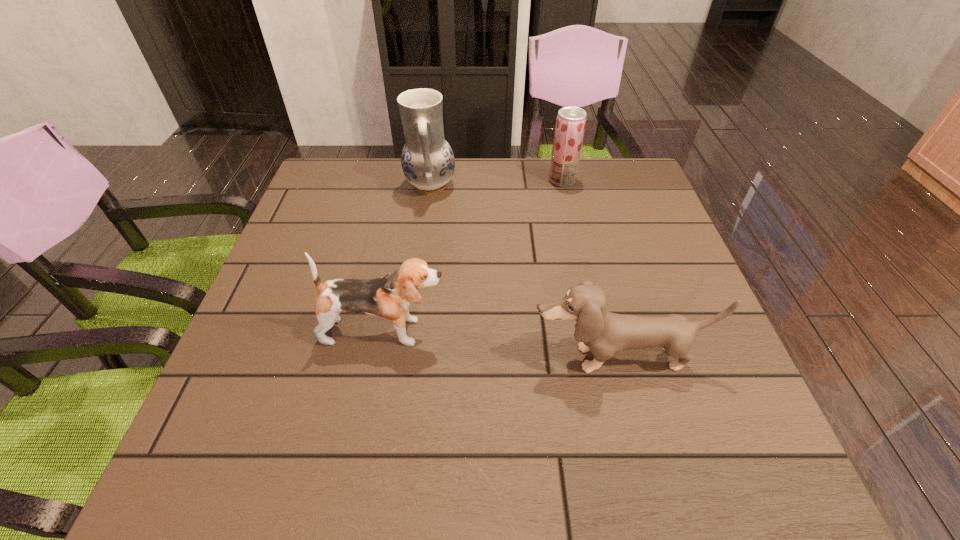
Identify the location of free space between the fruit juice and the tallest object. (496, 183).

The width and height of the screenshot is (960, 540). I want to click on free space between the right puppy and the fruit juice, so click(x=590, y=269).

Identify the location of empty space between the fruit juice and the left puppy. Image resolution: width=960 pixels, height=540 pixels. (473, 256).

Locate an element on the screen. This screenshot has height=540, width=960. blank region between the left puppy and the tallest object is located at coordinates (407, 259).

Where is `free area in between the left puppy and the right puppy`? The height and width of the screenshot is (540, 960). free area in between the left puppy and the right puppy is located at coordinates (501, 345).

I want to click on free space between the right puppy and the left puppy, so click(501, 345).

Where is `unoccupied position between the pottery and the left puppy`? unoccupied position between the pottery and the left puppy is located at coordinates (407, 259).

The width and height of the screenshot is (960, 540). I want to click on unoccupied area between the fruit juice and the pottery, so click(496, 183).

Select which object appears as the third closest to the left puppy. Please provide its 2D coordinates. Your answer should be formatted as a tuple, i.e. [(x, y)], where the tuple contains the x and y coordinates of a point satisfying the conditions above.

[(570, 124)]

Locate an element on the screen. This screenshot has height=540, width=960. object that is the third closest to the tallest object is located at coordinates (604, 333).